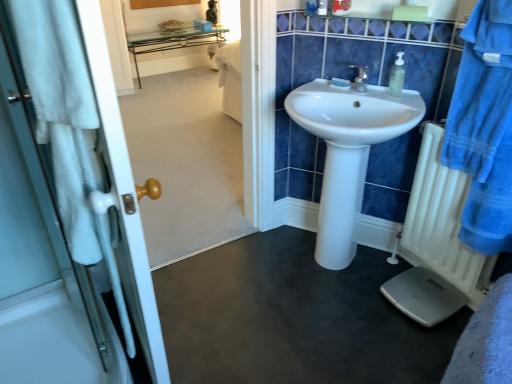
Locate an element on the screen. This screenshot has height=384, width=512. transparent plastic soap at center is located at coordinates (340, 83).

Describe the element at coordinates (372, 29) in the screenshot. I see `blue glossy tiles at upper center` at that location.

Where is `white plastic radiator at right`? white plastic radiator at right is located at coordinates (442, 223).

Based on the photo, how much distance is there between smooth white scale at center and white plastic radiator at right?

smooth white scale at center is 20.21 inches from white plastic radiator at right.

Which of these two, smooth white scale at center or white plastic radiator at right, is wider?

smooth white scale at center.

Looking at the image, does smooth white scale at center seem bigger or smaller compared to white plastic radiator at right?

Considering their sizes, smooth white scale at center takes up more space than white plastic radiator at right.

Is smooth white scale at center to the left of white plastic radiator at right from the viewer's perspective?

Correct, you'll find smooth white scale at center to the left of white plastic radiator at right.

Considering the sizes of white glossy door handle at left and white plastic radiator at right in the image, is white glossy door handle at left wider or thinner than white plastic radiator at right?

white glossy door handle at left is wider than white plastic radiator at right.

Between white glossy door handle at left and white plastic radiator at right, which one has smaller size?

white plastic radiator at right.

Is white glossy door handle at left further to the viewer compared to white plastic radiator at right?

No, it is in front of white plastic radiator at right.

Based on the photo, how distant is white glossy door handle at left from white plastic radiator at right?

A distance of 4.06 feet exists between white glossy door handle at left and white plastic radiator at right.

Is clear plastic soap dispenser at upper right in front of white glossy sink at center?

No, clear plastic soap dispenser at upper right is further to the viewer.

Is clear plastic soap dispenser at upper right not close to white glossy sink at center?

clear plastic soap dispenser at upper right is near white glossy sink at center, not far away.

Which is behind, point (397, 53) or point (379, 107)?

The point (379, 107) is farther.

Who is bigger, white glossy sink at center or transparent plastic soap at center?

white glossy sink at center is bigger.

From the image's perspective, is white glossy sink at center above transparent plastic soap at center?

No.

The image size is (512, 384). In order to click on soap above the white glossy sink at center (from the image's perspective) in this screenshot , I will do `click(340, 83)`.

From a real-world perspective, is blue glossy tiles at upper center over white glossy door handle at left?

Indeed, from a real-world perspective, blue glossy tiles at upper center stands above white glossy door handle at left.

Is blue glossy tiles at upper center placed right next to white glossy door handle at left?

There is a gap between blue glossy tiles at upper center and white glossy door handle at left.

Which is less distant, (386, 25) or (118, 204)?

Point (386, 25) is positioned farther from the camera compared to point (118, 204).

At what (x,y) coordinates should I click in order to perform the action: click on door on the left of blue glossy tiles at upper center. Please return your answer as a coordinate pair (x, y). The width and height of the screenshot is (512, 384). Looking at the image, I should click on (120, 194).

Where is `soap dispenser above the smooth white scale at center (from a real-world perspective)`? soap dispenser above the smooth white scale at center (from a real-world perspective) is located at coordinates (397, 76).

From a real-world perspective, is smooth white scale at center above or below clear plastic soap dispenser at upper right?

smooth white scale at center is situated lower than clear plastic soap dispenser at upper right in the real world.

In the scene shown: Looking at the image, does smooth white scale at center seem bigger or smaller compared to clear plastic soap dispenser at upper right?

In the image, smooth white scale at center appears to be larger than clear plastic soap dispenser at upper right.

Does smooth white scale at center turn towards clear plastic soap dispenser at upper right?

No.

From the image's perspective, between smooth white scale at center and blue cotton bathrobe at right, which one is located above?

blue cotton bathrobe at right.

Is smooth white scale at center not close to blue cotton bathrobe at right?

No, there isn't a large distance between smooth white scale at center and blue cotton bathrobe at right.

Between point (340, 364) and point (495, 90), which one is positioned in front?

The point (495, 90) is closer to the camera.

Is smooth white scale at center looking in the opposite direction of blue cotton bathrobe at right?

That's not correct — smooth white scale at center is not looking away from blue cotton bathrobe at right.

Find the location of `plain that appears below the white plastic radiator at right (from a real-world perspective)`. plain that appears below the white plastic radiator at right (from a real-world perspective) is located at coordinates (293, 317).

In the image, there is a white plastic radiator at right. Identify the location of door below it (from the image's perspective). This screenshot has width=512, height=384. (x=120, y=194).

From the image, which object appears to be farther from blue cotton bathrobe at right, blue glossy tiles at upper center or smooth white scale at center?

smooth white scale at center.

Which object lies nearer to the anchor point transparent plastic soap at center, clear plastic soap dispenser at upper right or white glossy sink at center?

clear plastic soap dispenser at upper right.

When comparing their distances from clear plastic soap dispenser at upper right, does blue glossy tiles at upper center or transparent plastic soap at center seem closer?

The object closer to clear plastic soap dispenser at upper right is transparent plastic soap at center.

Considering their positions, is smooth white scale at center positioned further to transparent plastic soap at center than blue cotton bathrobe at right?

Based on the image, smooth white scale at center appears to be further to transparent plastic soap at center.

Based on their spatial positions, is smooth white scale at center or blue glossy tiles at upper center further from white plastic radiator at right?

The object further to white plastic radiator at right is blue glossy tiles at upper center.

When comparing their distances from white plastic radiator at right, does clear plastic soap dispenser at upper right or white glossy door handle at left seem closer?

The object closer to white plastic radiator at right is clear plastic soap dispenser at upper right.

Looking at the image, which one is located further to white plastic radiator at right, clear plastic soap dispenser at upper right or blue glossy tiles at upper center?

blue glossy tiles at upper center is further to white plastic radiator at right.

Considering their positions, is blue glossy tiles at upper center positioned further to blue cotton bathrobe at right than white plastic radiator at right?

blue glossy tiles at upper center.

The image size is (512, 384). Find the location of `soap dispenser positioned between blue cotton bathrobe at right and transparent plastic soap at center from near to far`. soap dispenser positioned between blue cotton bathrobe at right and transparent plastic soap at center from near to far is located at coordinates [397, 76].

Image resolution: width=512 pixels, height=384 pixels. I want to click on soap dispenser between blue glossy tiles at upper center and white plastic radiator at right in the vertical direction, so click(397, 76).

Image resolution: width=512 pixels, height=384 pixels. Identify the location of bathrobe between blue glossy tiles at upper center and smooth white scale at center in the up-down direction. (484, 127).

I want to click on soap dispenser between white glossy door handle at left and blue cotton bathrobe at right from left to right, so click(x=397, y=76).